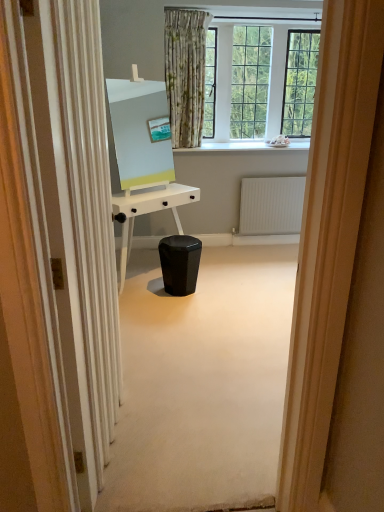
You are a GUI agent. You are given a task and a screenshot of the screen. Output one action in this format:
    pyautogui.click(x=<x>, y=<y>)
    Task: Click on the free point to the right of white glossy screen door at left
    Image resolution: width=384 pixels, height=512 pixels.
    Given the screenshot: What is the action you would take?
    pyautogui.click(x=198, y=429)